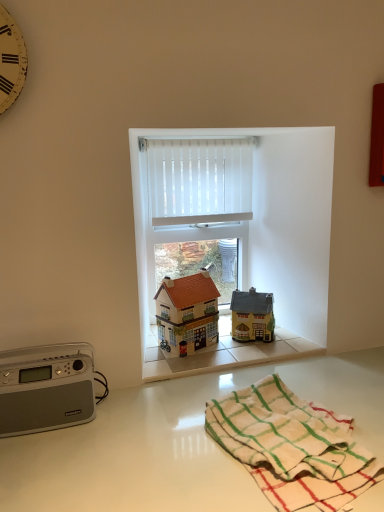
The width and height of the screenshot is (384, 512). Describe the element at coordinates (188, 312) in the screenshot. I see `matte brown house at center, the 2th toy from the right` at that location.

This screenshot has height=512, width=384. Find the location of `matte brown house at center, the 2th toy from the right`. matte brown house at center, the 2th toy from the right is located at coordinates (188, 312).

The height and width of the screenshot is (512, 384). What do you see at coordinates (177, 442) in the screenshot?
I see `white glossy countertop at lower center` at bounding box center [177, 442].

The image size is (384, 512). What do you see at coordinates (284, 432) in the screenshot?
I see `white cotton towel at lower right` at bounding box center [284, 432].

Measure the distance between yellow painted wood clock at upper left and camera.

yellow painted wood clock at upper left is 36.30 inches from camera.

The image size is (384, 512). What do you see at coordinates (11, 60) in the screenshot? I see `yellow painted wood clock at upper left` at bounding box center [11, 60].

This screenshot has height=512, width=384. Find the location of `matte yellow house at center, the 1th toy when ordered from right to left`. matte yellow house at center, the 1th toy when ordered from right to left is located at coordinates (252, 316).

The image size is (384, 512). In order to click on silver metallic radio at left in this screenshot , I will do `click(46, 388)`.

From a real-world perspective, between matte yellow house at center, the 1th toy when ordered from right to left, and white vertical blinds at center, who is vertically lower?

From a 3D spatial view, matte yellow house at center, the 1th toy when ordered from right to left, is below.

Relative to white vertical blinds at center, is matte yellow house at center, the 1th toy when ordered from right to left, in front or behind?

matte yellow house at center, the 1th toy when ordered from right to left, is in front of white vertical blinds at center.

Which object is positioned more to the left, matte yellow house at center, the 1th toy when ordered from right to left, or white vertical blinds at center?

white vertical blinds at center.

Is white vertical blinds at center facing away from white glossy countertop at lower center?

white vertical blinds at center is not turned away from white glossy countertop at lower center.

Can you confirm if white vertical blinds at center is positioned to the right of white glossy countertop at lower center?

No, white vertical blinds at center is not to the right of white glossy countertop at lower center.

Is there a large distance between white vertical blinds at center and white glossy countertop at lower center?

No.

From a real-world perspective, which is physically below, silver metallic radio at left or matte brown house at center, which ranks as the 1th toy in left-to-right order?

silver metallic radio at left.

Does point (22, 412) lie in front of point (182, 282)?

Yes, it is.

Considering the relative positions of silver metallic radio at left and matte brown house at center, the 2th toy from the right, in the image provided, is silver metallic radio at left to the left of matte brown house at center, the 2th toy from the right, from the viewer's perspective?

Correct, you'll find silver metallic radio at left to the left of matte brown house at center, the 2th toy from the right.

Consider the image. Is silver metallic radio at left spatially inside matte brown house at center, which ranks as the 1th toy in left-to-right order, or outside of it?

silver metallic radio at left is outside matte brown house at center, which ranks as the 1th toy in left-to-right order.

Is matte brown house at center, which ranks as the 1th toy in left-to-right order, positioned before white cotton towel at lower right?

Result: No, matte brown house at center, which ranks as the 1th toy in left-to-right order, is further to the viewer.

From their relative heights in the image, would you say matte brown house at center, which ranks as the 1th toy in left-to-right order, is taller or shorter than white cotton towel at lower right?

In the image, matte brown house at center, which ranks as the 1th toy in left-to-right order, appears to be taller than white cotton towel at lower right.

In terms of size, does matte brown house at center, which ranks as the 1th toy in left-to-right order, appear bigger or smaller than white cotton towel at lower right?

In the image, matte brown house at center, which ranks as the 1th toy in left-to-right order, appears to be smaller than white cotton towel at lower right.

From the image's perspective, would you say matte brown house at center, which ranks as the 1th toy in left-to-right order, is positioned over white cotton towel at lower right?

Yes, from the image's perspective, matte brown house at center, which ranks as the 1th toy in left-to-right order, is above white cotton towel at lower right.

Is point (163, 320) closer or farther from the camera than point (9, 16)?

Point (163, 320) is farther from the camera than point (9, 16).

Is yellow painted wood clock at upper left located within matte brown house at center, which ranks as the 1th toy in left-to-right order?

Definitely not — yellow painted wood clock at upper left is not inside matte brown house at center, which ranks as the 1th toy in left-to-right order.

Is matte brown house at center, which ranks as the 1th toy in left-to-right order, next to yellow painted wood clock at upper left?

matte brown house at center, which ranks as the 1th toy in left-to-right order, and yellow painted wood clock at upper left are clearly separated.

From a real-world perspective, is white vertical blinds at center positioned under silver metallic radio at left based on gravity?

No, from a real-world perspective, white vertical blinds at center is not below silver metallic radio at left.

Which object is positioned more to the left, white vertical blinds at center or silver metallic radio at left?

Positioned to the left is silver metallic radio at left.

Is there a large distance between white vertical blinds at center and silver metallic radio at left?

white vertical blinds at center is near silver metallic radio at left, not far away.

Would you say yellow painted wood clock at upper left is outside silver metallic radio at left?

Indeed, yellow painted wood clock at upper left is completely outside silver metallic radio at left.

Which object is thinner, yellow painted wood clock at upper left or silver metallic radio at left?

Thinner between the two is yellow painted wood clock at upper left.

Who is shorter, yellow painted wood clock at upper left or silver metallic radio at left?

silver metallic radio at left.

Is yellow painted wood clock at upper left positioned far away from silver metallic radio at left?

That's not correct — yellow painted wood clock at upper left is a little close to silver metallic radio at left.

This screenshot has height=512, width=384. In order to click on the 2nd toy below when counting from the white vertical blinds at center (from the image's perspective) in this screenshot , I will do `click(252, 316)`.

You are a GUI agent. You are given a task and a screenshot of the screen. Output one action in this format:
    pyautogui.click(x=<x>, y=<y>)
    Task: Click on the counter top on the right of the white vertical blinds at center
    The width and height of the screenshot is (384, 512).
    Given the screenshot: What is the action you would take?
    pyautogui.click(x=177, y=442)

Based on their spatial positions, is white vertical blinds at center or white glossy countertop at lower center further from silver metallic radio at left?

The object further to silver metallic radio at left is white vertical blinds at center.

When comparing their distances from yellow painted wood clock at upper left, does white cotton towel at lower right or silver metallic radio at left seem closer?

silver metallic radio at left is positioned closer to the anchor yellow painted wood clock at upper left.

Which object lies nearer to the anchor point matte yellow house at center, the second toy viewed from the left, silver metallic radio at left or yellow painted wood clock at upper left?

silver metallic radio at left is closer to matte yellow house at center, the second toy viewed from the left.

From the image, which object appears to be farther from white vertical blinds at center, matte yellow house at center, the 1th toy when ordered from right to left, or silver metallic radio at left?

silver metallic radio at left.

Looking at the image, which one is located closer to yellow painted wood clock at upper left, matte brown house at center, which ranks as the 1th toy in left-to-right order, or silver metallic radio at left?

Based on the image, silver metallic radio at left appears to be nearer to yellow painted wood clock at upper left.

Based on their spatial positions, is matte yellow house at center, the 1th toy when ordered from right to left, or yellow painted wood clock at upper left closer to white cotton towel at lower right?

Based on the image, matte yellow house at center, the 1th toy when ordered from right to left, appears to be nearer to white cotton towel at lower right.

Which object lies nearer to the anchor point white cotton towel at lower right, white glossy countertop at lower center or white vertical blinds at center?

Among the two, white glossy countertop at lower center is located nearer to white cotton towel at lower right.

Estimate the real-world distances between objects in this image. Which object is closer to white vertical blinds at center, matte brown house at center, the 2th toy from the right, or white glossy countertop at lower center?

The object closer to white vertical blinds at center is matte brown house at center, the 2th toy from the right.

The image size is (384, 512). What are the coordinates of `toy between yellow painted wood clock at upper left and matte yellow house at center, the 1th toy when ordered from right to left` in the screenshot? It's located at (188, 312).

The width and height of the screenshot is (384, 512). In order to click on curtain between yellow painted wood clock at upper left and silver metallic radio at left from top to bottom in this screenshot , I will do point(199,181).

Identify the location of curtain between yellow painted wood clock at upper left and matte yellow house at center, the 1th toy when ordered from right to left, from left to right. Image resolution: width=384 pixels, height=512 pixels. (199, 181).

At what (x,y) coordinates should I click in order to perform the action: click on appliance positioned between white glossy countertop at lower center and matte brown house at center, which ranks as the 1th toy in left-to-right order, from near to far. Please return your answer as a coordinate pair (x, y). Looking at the image, I should click on point(46,388).